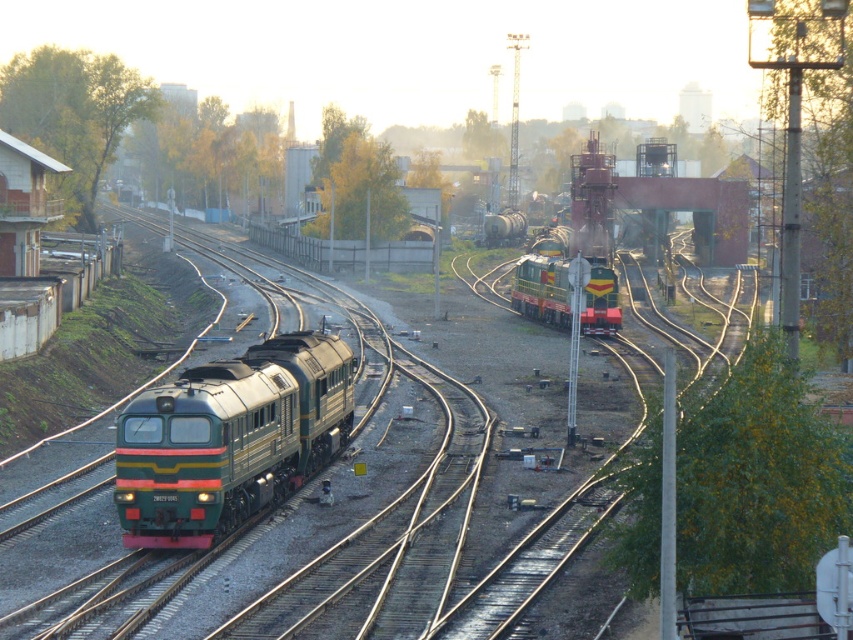
Question: Can you confirm if green matte train at left is thinner than green metallic locomotive at center?

Choices:
 (A) yes
 (B) no

Answer: (A)

Question: Which point is farther to the camera?

Choices:
 (A) green metallic train at left
 (B) green matte train at left

Answer: (B)

Question: Which point is farther to the camera?

Choices:
 (A) (590, 294)
 (B) (296, 513)

Answer: (A)

Question: Can you confirm if green metallic train at left is positioned to the left of green matte train at left?

Choices:
 (A) yes
 (B) no

Answer: (A)

Question: Is green matte train at left further to camera compared to green metallic locomotive at center?

Choices:
 (A) yes
 (B) no

Answer: (B)

Question: Based on their relative distances, which object is nearer to the green metallic locomotive at center?

Choices:
 (A) green matte train at left
 (B) green metallic train at left

Answer: (B)